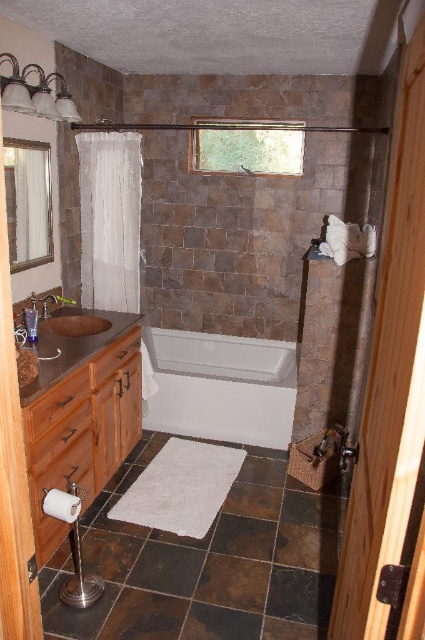
Question: Is brown wood vanity at left thinner than matte brown sink at lower left?

Choices:
 (A) yes
 (B) no

Answer: (B)

Question: Which of the following is the farthest from the observer?

Choices:
 (A) (255, 588)
 (B) (229, 529)

Answer: (B)

Question: Which object is positioned closest to the matte brown sink at lower left?

Choices:
 (A) brown wood vanity at left
 (B) dark brown tile at center
 (C) brown textured tile at lower center
 (D) white glossy bathtub at center

Answer: (A)

Question: Which of these objects is positioned farthest from the dark brown stone tile at center?

Choices:
 (A) matte brown sink at lower left
 (B) dark brown tile at center

Answer: (A)

Question: Does brown wood vanity at left appear over brown textured tile at lower center?

Choices:
 (A) no
 (B) yes

Answer: (B)

Question: Is white glossy bathtub at center closer to the viewer compared to dark brown stone tile at center?

Choices:
 (A) yes
 (B) no

Answer: (B)